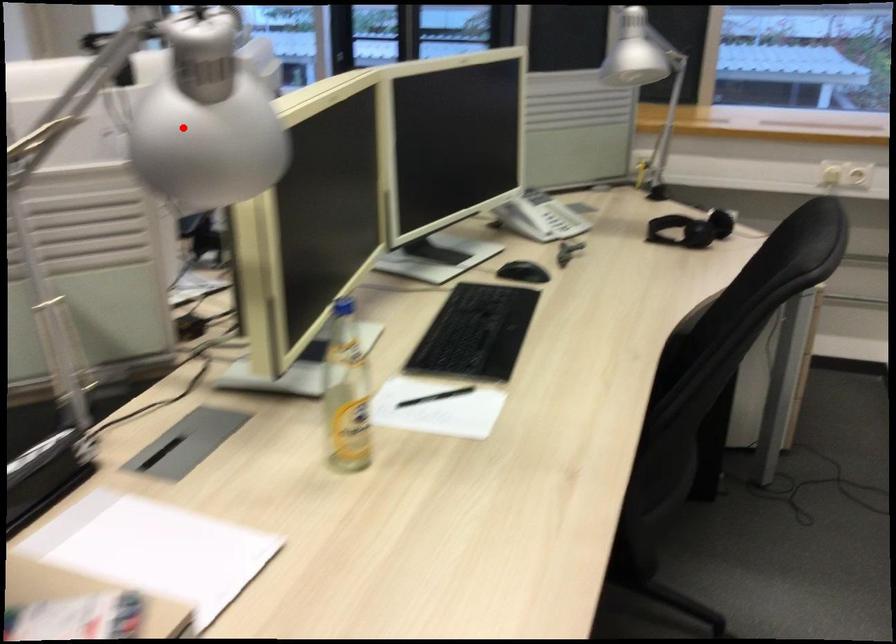
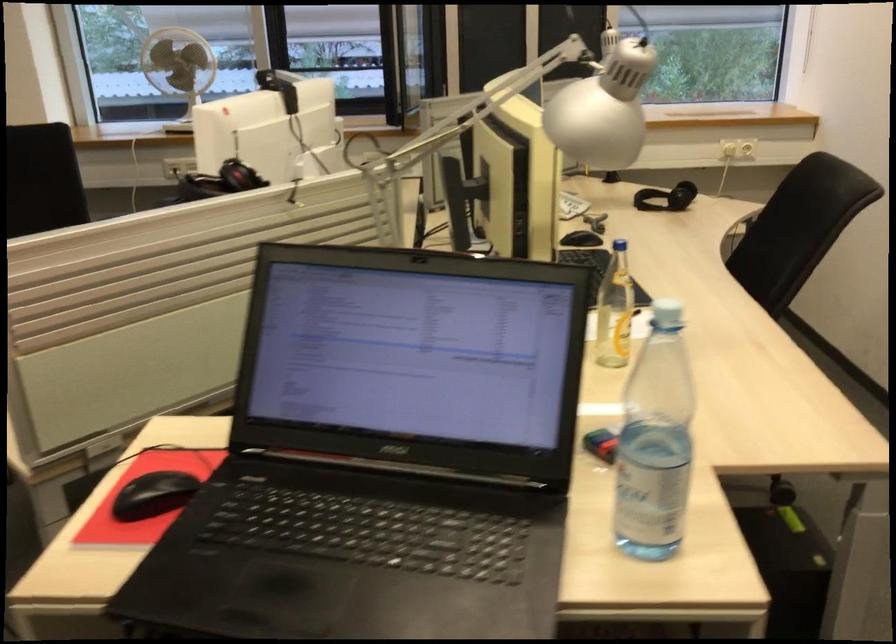
Locate, in the second image, the point that corresponds to the highlighted location in the first image.

(604, 109)